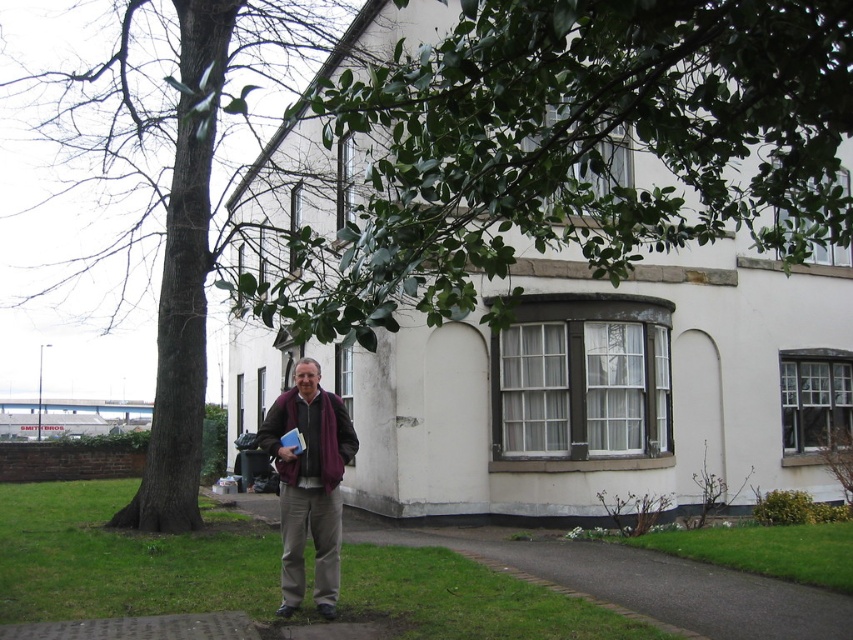
You are a photographer trying to capture a shot of the man and the two green elements in the scene. Which green leafy branch at upper center or green leafy tree at center is positioned to the right side of the other?

The green leafy branch at upper center is to the right of the green leafy tree at center.

You are a photographer taking a portrait of the man in the scene. You notice the green leafy branch at upper center and the maroon wool scarf at center. Which object is positioned higher in the frame?

The green leafy branch at upper center is located above the maroon wool scarf at center, so it is positioned higher in the frame.

You are a photographer trying to capture a photo of the green leafy tree at center and the maroon wool scarf at center. Which object should you focus on first to ensure it appears sharp in the photo?

The green leafy tree at center is closer to the viewer than the maroon wool scarf at center, so you should focus on the green leafy tree at center first to ensure it appears sharp in the photo.